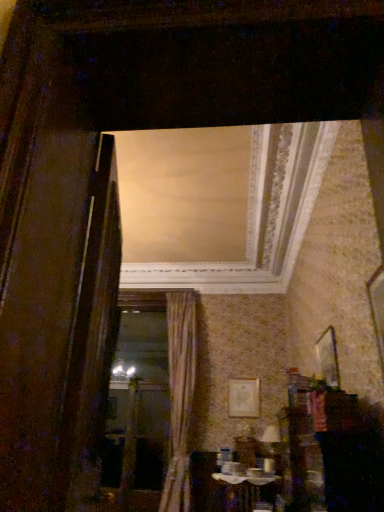
Question: Does gold textured curtain at center have a lesser width compared to wooden frame at center?

Choices:
 (A) no
 (B) yes

Answer: (A)

Question: Is gold textured curtain at center turned away from wooden frame at center?

Choices:
 (A) yes
 (B) no

Answer: (B)

Question: Is gold textured curtain at center to the right of wooden frame at center from the viewer's perspective?

Choices:
 (A) no
 (B) yes

Answer: (B)

Question: Is gold textured curtain at center outside of wooden frame at center?

Choices:
 (A) no
 (B) yes

Answer: (B)

Question: From a real-world perspective, is gold textured curtain at center below wooden frame at center?

Choices:
 (A) yes
 (B) no

Answer: (B)

Question: Is gold textured curtain at center at the left side of wooden frame at center?

Choices:
 (A) yes
 (B) no

Answer: (B)

Question: From a real-world perspective, does matte gold picture frame at center, the 2th picture frame viewed from the front, sit lower than wooden picture frame at upper right, the first picture frame when ordered from front to back?

Choices:
 (A) no
 (B) yes

Answer: (B)

Question: Is matte gold picture frame at center, which ranks as the first picture frame in bottom-to-top order, outside wooden picture frame at upper right, marked as the 2th picture frame in a back-to-front arrangement?

Choices:
 (A) yes
 (B) no

Answer: (A)

Question: Does matte gold picture frame at center, which is the 2th picture frame in top-to-bottom order, have a smaller size compared to wooden picture frame at upper right, which ranks as the 2th picture frame in left-to-right order?

Choices:
 (A) yes
 (B) no

Answer: (A)

Question: Is wooden picture frame at upper right, marked as the 1th picture frame in a right-to-left arrangement, at the back of matte gold picture frame at center, which ranks as the first picture frame in bottom-to-top order?

Choices:
 (A) no
 (B) yes

Answer: (A)

Question: Considering the relative sizes of matte gold picture frame at center, which is the 2th picture frame in top-to-bottom order, and wooden picture frame at upper right, which is the second picture frame from bottom to top, in the image provided, is matte gold picture frame at center, which is the 2th picture frame in top-to-bottom order, wider than wooden picture frame at upper right, which is the second picture frame from bottom to top,?

Choices:
 (A) no
 (B) yes

Answer: (A)

Question: Does matte gold picture frame at center, which ranks as the first picture frame in bottom-to-top order, come behind wooden picture frame at upper right, which is the second picture frame from bottom to top?

Choices:
 (A) yes
 (B) no

Answer: (A)

Question: From a real-world perspective, does wooden picture frame at upper right, which is the second picture frame from bottom to top, sit lower than matte gold picture frame at center, the 2th picture frame viewed from the front?

Choices:
 (A) no
 (B) yes

Answer: (A)